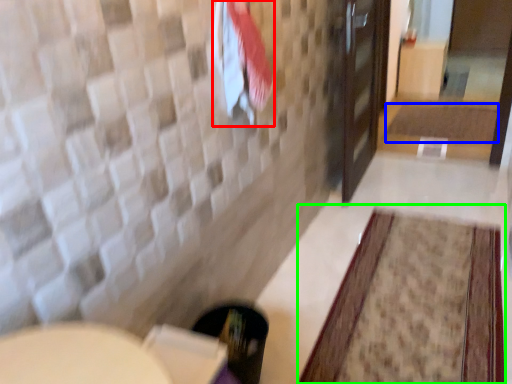
Question: Based on their relative distances, which object is nearer to beach towel (highlighted by a red box)? Choose from bath mat (highlighted by a blue box) and bath mat (highlighted by a green box).

Choices:
 (A) bath mat
 (B) bath mat

Answer: (B)